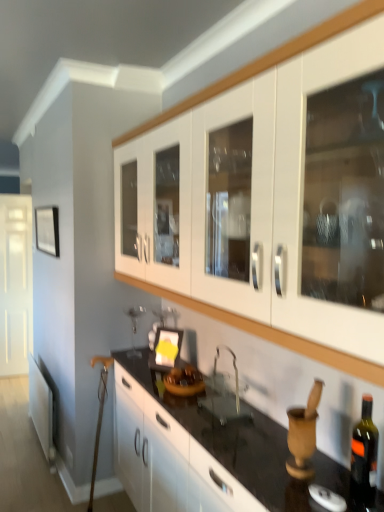
Question: Which direction should I rotate to look at matte black picture frame at center, the second picture frame positioned from the left, — up or down?

Choices:
 (A) down
 (B) up

Answer: (A)

Question: Considering the relative positions of matte black picture frame at left, which is the 1th picture frame in left-to-right order, and matte black picture frame at center, the second picture frame in the back-to-front sequence, in the image provided, is matte black picture frame at left, which is the 1th picture frame in left-to-right order, to the left of matte black picture frame at center, the second picture frame in the back-to-front sequence, from the viewer's perspective?

Choices:
 (A) yes
 (B) no

Answer: (A)

Question: Is matte black picture frame at left, acting as the first picture frame starting from the top, shorter than matte black picture frame at center, the 1th picture frame positioned from the right?

Choices:
 (A) no
 (B) yes

Answer: (A)

Question: Would you say matte black picture frame at center, the 1th picture frame positioned from the right, is part of matte black picture frame at left, which ranks as the 1th picture frame in back-to-front order,'s contents?

Choices:
 (A) yes
 (B) no

Answer: (B)

Question: Is matte black picture frame at left, which ranks as the second picture frame in front-to-back order, not within matte black picture frame at center, the 1th picture frame positioned from the right?

Choices:
 (A) no
 (B) yes

Answer: (B)

Question: Is matte black picture frame at left, which is the 1th picture frame in left-to-right order, bigger than matte black picture frame at center, the 1th picture frame positioned from the right?

Choices:
 (A) no
 (B) yes

Answer: (B)

Question: From a real-world perspective, is matte black picture frame at left, marked as the second picture frame in a bottom-to-top arrangement, physically above matte black picture frame at center, the 1th picture frame positioned from the front?

Choices:
 (A) yes
 (B) no

Answer: (A)

Question: Can you see clear glass sink at center touching white glossy door at left?

Choices:
 (A) yes
 (B) no

Answer: (B)

Question: Is clear glass sink at center behind white glossy door at left?

Choices:
 (A) no
 (B) yes

Answer: (A)

Question: Is white glossy door at left at the back of clear glass sink at center?

Choices:
 (A) yes
 (B) no

Answer: (B)

Question: Are clear glass sink at center and white glossy door at left located far from each other?

Choices:
 (A) yes
 (B) no

Answer: (A)

Question: Is clear glass sink at center shorter than white glossy door at left?

Choices:
 (A) no
 (B) yes

Answer: (B)

Question: Does clear glass sink at center lie in front of white glossy door at left?

Choices:
 (A) yes
 (B) no

Answer: (A)

Question: Is matte black picture frame at left, which is counted as the 2th picture frame, starting from the right, surrounding clear glass sink at center?

Choices:
 (A) yes
 (B) no

Answer: (B)